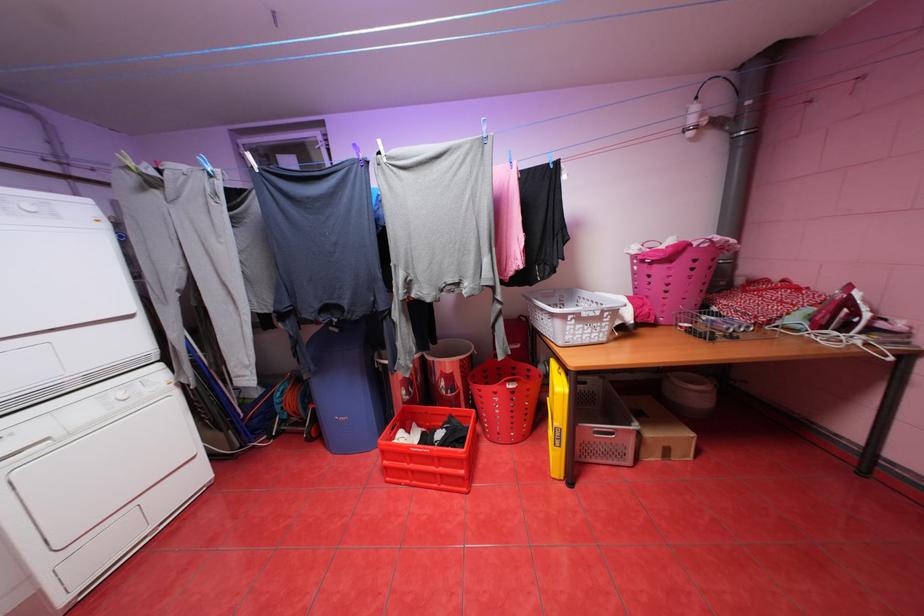
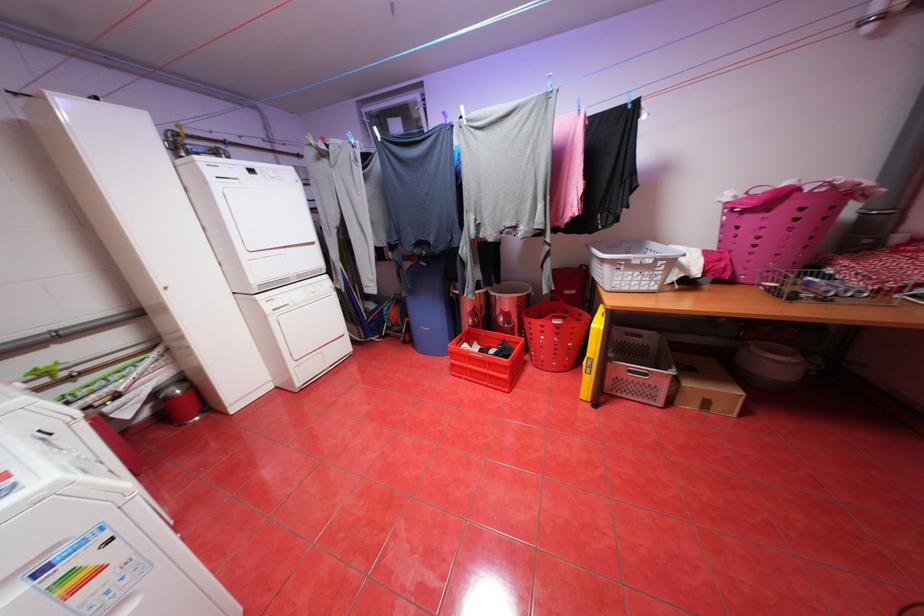
In the second image, find the point that corresponds to pixel 643 426 in the first image.

(681, 371)